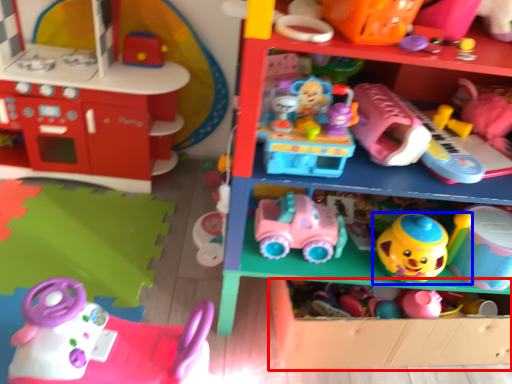
Question: Which object appears farthest to the camera in this image, shelf (highlighted by a red box) or toy (highlighted by a blue box)?

Choices:
 (A) shelf
 (B) toy

Answer: (A)